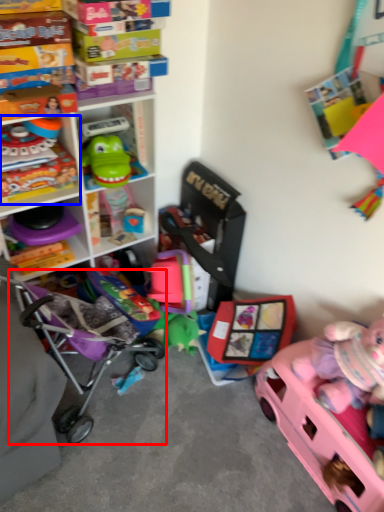
Question: Which point is further to the camera, baby carriage (highlighted by a red box) or toy (highlighted by a blue box)?

Choices:
 (A) baby carriage
 (B) toy

Answer: (B)